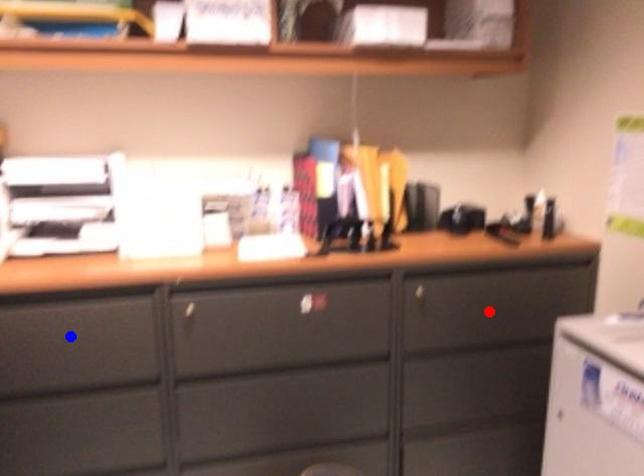
Question: Which of the two points in the image is closer to the camera?

Choices:
 (A) Blue point is closer.
 (B) Red point is closer.

Answer: (A)